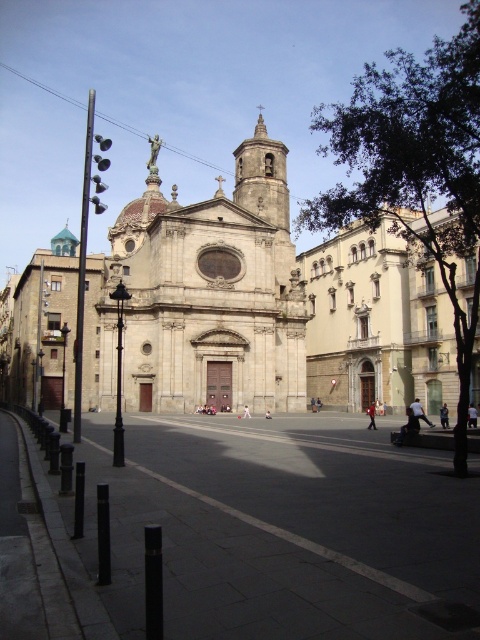
Is dark concrete plaza at center positioned at the back of smooth stone bell tower at center?

No, it is in front of smooth stone bell tower at center.

Is point (112, 500) positioned in front of point (233, 195)?

That is True.

You are a GUI agent. You are given a task and a screenshot of the screen. Output one action in this format:
    pyautogui.click(x=<x>, y=<y>)
    Task: Click on the dark concrete plaza at center
    The height and width of the screenshot is (640, 480).
    Given the screenshot: What is the action you would take?
    pyautogui.click(x=286, y=531)

Is dark concrete plaza at center to the right of gray stone church at center from the viewer's perspective?

Indeed, dark concrete plaza at center is positioned on the right side of gray stone church at center.

Is dark concrete plaza at center closer to the viewer compared to gray stone church at center?

Yes, dark concrete plaza at center is in front of gray stone church at center.

In order to click on dark concrete plaza at center in this screenshot , I will do `click(286, 531)`.

This screenshot has height=640, width=480. In order to click on dark concrete plaza at center in this screenshot , I will do `click(286, 531)`.

Which is below, gray stone church at center or smooth stone bell tower at center?

Positioned lower is gray stone church at center.

Does point (112, 337) come farther from viewer compared to point (239, 177)?

That is False.

This screenshot has height=640, width=480. What are the coordinates of `gray stone church at center` in the screenshot? It's located at (204, 298).